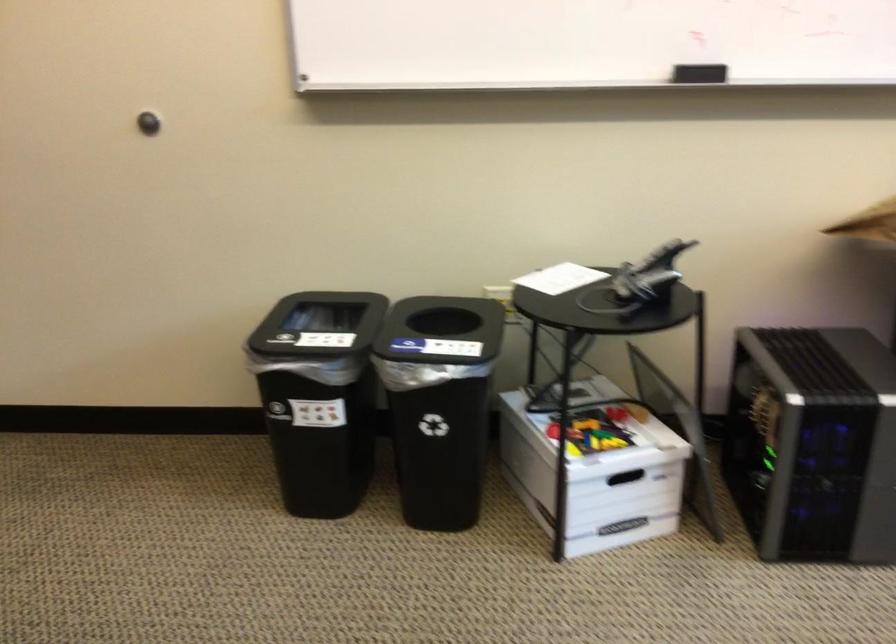
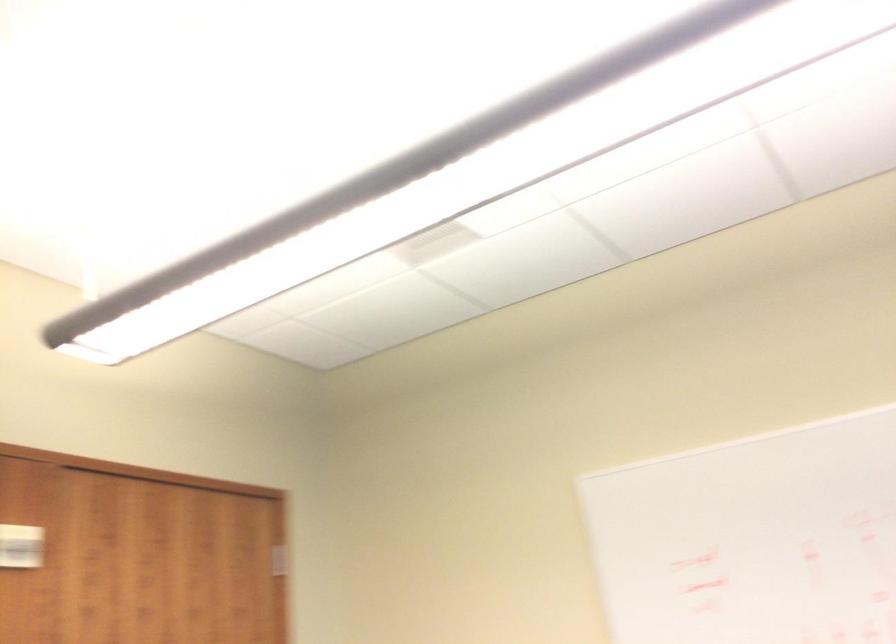
The images are taken continuously from a first-person perspective. In which direction is your viewpoint rotating?

The camera rotated toward left-up.